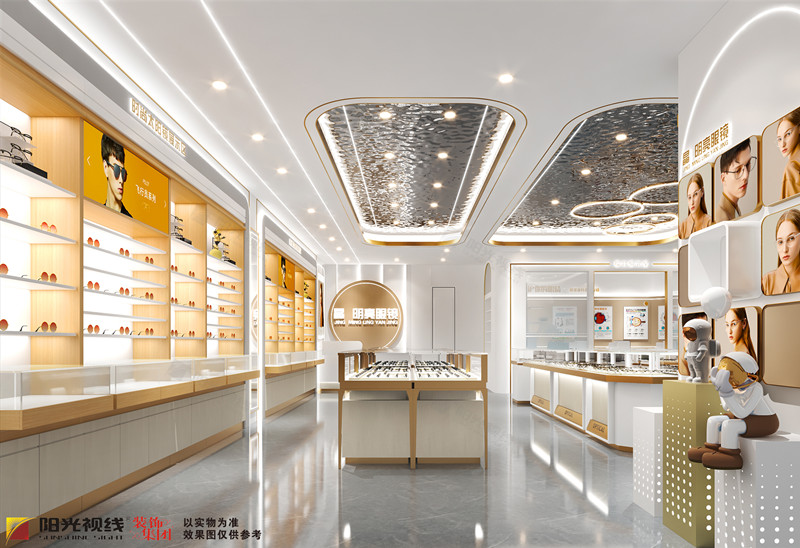
The height and width of the screenshot is (548, 800). In order to click on marble floor in this screenshot , I will do (x=250, y=489), (x=512, y=490), (x=517, y=410), (x=310, y=414).